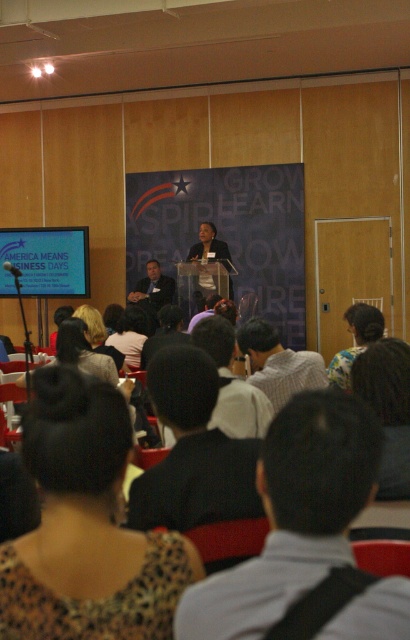
Question: Which point is closer to the camera taking this photo?

Choices:
 (A) (273, 336)
 (B) (161, 620)
 (C) (252, 394)
 (D) (334, 397)

Answer: (B)

Question: Can you confirm if blue fabric projection screen at left is wider than white cotton shirt at center?

Choices:
 (A) no
 (B) yes

Answer: (B)

Question: From the image, what is the correct spatial relationship of leopard print blouse at lower left in relation to white cotton shirt at center?

Choices:
 (A) left
 (B) right

Answer: (A)

Question: Which point appears farthest from the camera in this image?

Choices:
 (A) (343, 365)
 (B) (114, 492)
 (C) (136, 296)

Answer: (C)

Question: Which object appears closest to the camera in this image?

Choices:
 (A) light gray shirt at center
 (B) matte black shirt at center
 (C) blue fabric projection screen at left
 (D) leopard print blouse at lower left

Answer: (A)

Question: Does white shirt at center appear on the right side of blonde hair at center?

Choices:
 (A) yes
 (B) no

Answer: (A)